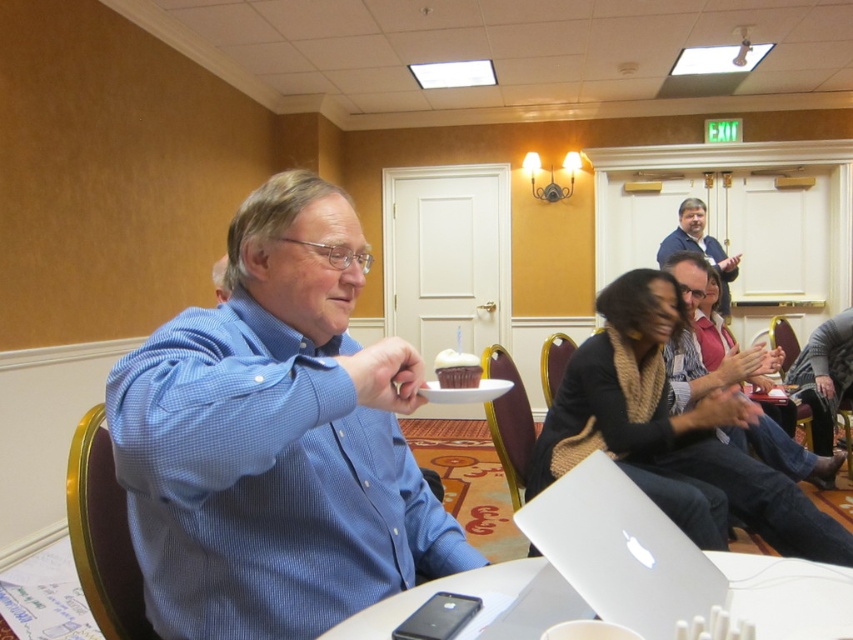
You are organizing a surprise birthday party in this conference room and need to ensure the blue shirt at center can reach the white matte laptop at lower center without moving from their current position. What is the minimum distance they need to cover to reach each other?

The blue shirt at center and the white matte laptop at lower center are 12.22 feet apart. To reach each other without moving from their current positions, they would need to cover a minimum distance of 12.22 feet.

Consider the image. You are organizing a winter clothing drive and need to pack scarves into boxes. The knitted scarf at center and the smooth beige scarf at center are both on a table. Which scarf will require more space in the box due to its larger size?

The smooth beige scarf at center requires more space because it is larger in size compared to the knitted scarf at center.

You are a photographer standing in the conference room. You want to take a photo of the knitted scarf at center without moving any objects. Can you focus on the scarf clearly if your camera has a maximum focus distance of 1.5 meters?

The knitted scarf at center is 1.69 meters from the camera, which exceeds the maximum focus distance of 1.5 meters. Therefore, the camera cannot focus on the scarf clearly without moving closer or adjusting settings.